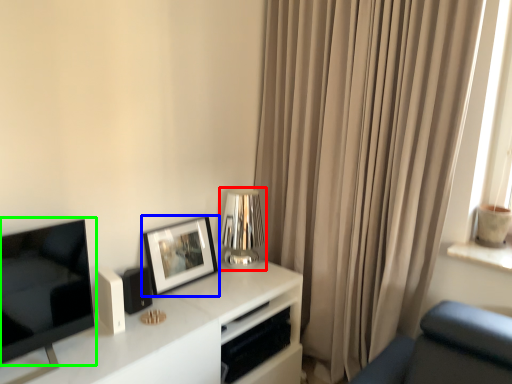
Question: Which is nearer to the table lamp (highlighted by a red box)? picture frame (highlighted by a blue box) or television (highlighted by a green box).

Choices:
 (A) picture frame
 (B) television

Answer: (A)